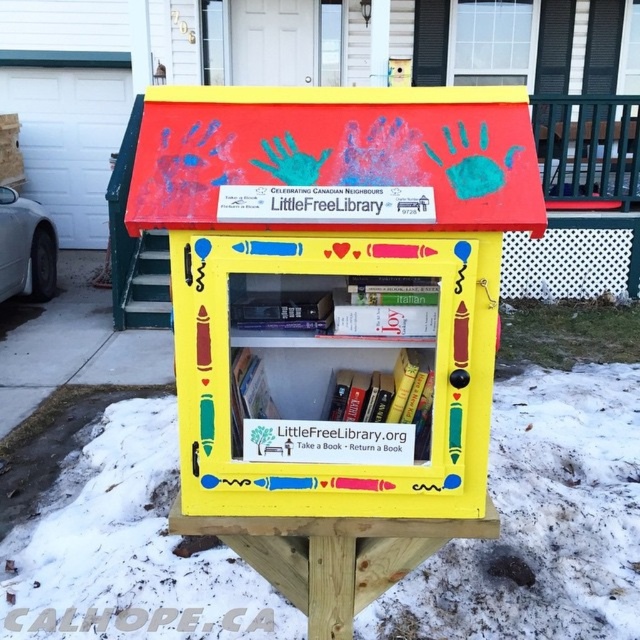
Question: Is white powdery snow at lower center wider than hardcover book at center?

Choices:
 (A) no
 (B) yes

Answer: (B)

Question: Can you confirm if white powdery snow at lower center is positioned to the right of hardcover book at center?

Choices:
 (A) yes
 (B) no

Answer: (A)

Question: Among these objects, which one is nearest to the camera?

Choices:
 (A) white powdery snow at lower center
 (B) hardcover book at center

Answer: (B)

Question: Is white powdery snow at lower center above hardcover book at center?

Choices:
 (A) no
 (B) yes

Answer: (A)